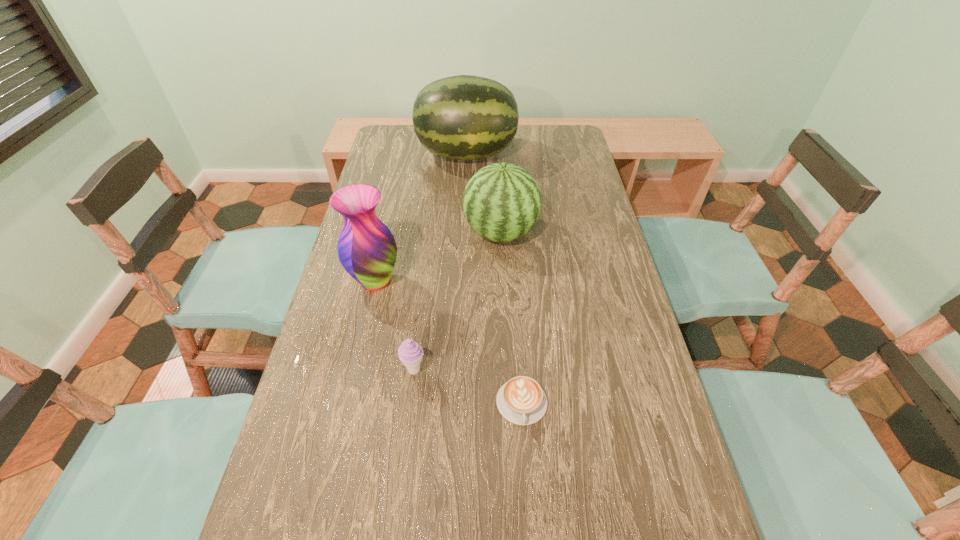
This screenshot has height=540, width=960. What are the coordinates of `the farther watermelon` in the screenshot? It's located at (464, 117).

Locate an element on the screen. The height and width of the screenshot is (540, 960). the third farthest object is located at coordinates (367, 250).

The width and height of the screenshot is (960, 540). I want to click on the fourth nearest object, so click(501, 202).

Locate an element on the screen. icecream is located at coordinates (410, 353).

You are a GUI agent. You are given a task and a screenshot of the screen. Output one action in this format:
    pyautogui.click(x=<x>, y=<y>)
    Task: Click on the cappuccino
    The width and height of the screenshot is (960, 540).
    Given the screenshot: What is the action you would take?
    pyautogui.click(x=521, y=400)

Locate an element on the screen. The image size is (960, 540). vacant area located 0.340m on the front of the farthest object is located at coordinates (464, 237).

I want to click on free spot located 0.320m on the front of the vase, so click(x=346, y=414).

In order to click on vacant position located 0.330m on the back of the fourth nearest object in this screenshot , I will do `click(496, 157)`.

This screenshot has width=960, height=540. Find the location of `free space located on the front of the icecream`. free space located on the front of the icecream is located at coordinates (408, 418).

Find the location of a particular element. The width and height of the screenshot is (960, 540). free location located on the side of the cappuccino with the handle is located at coordinates (530, 517).